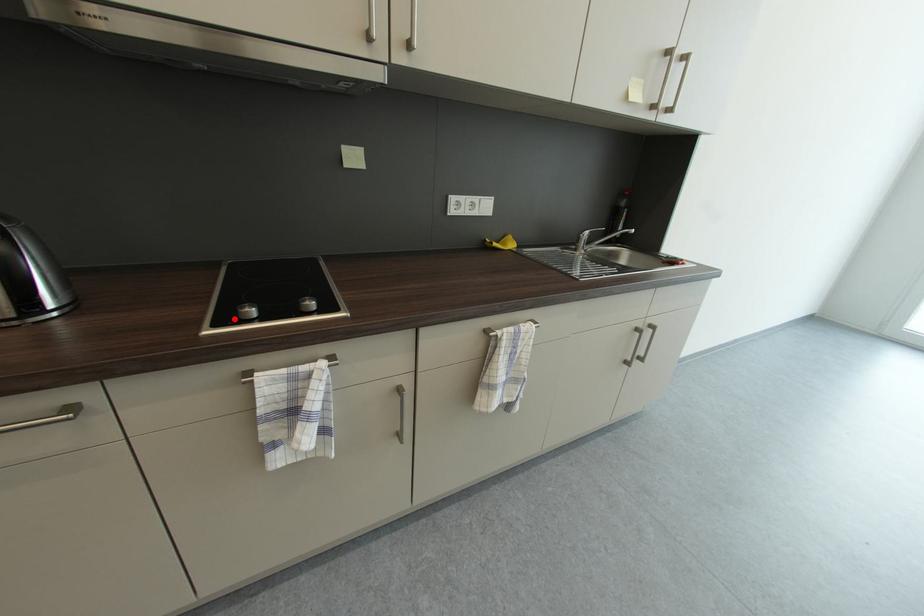
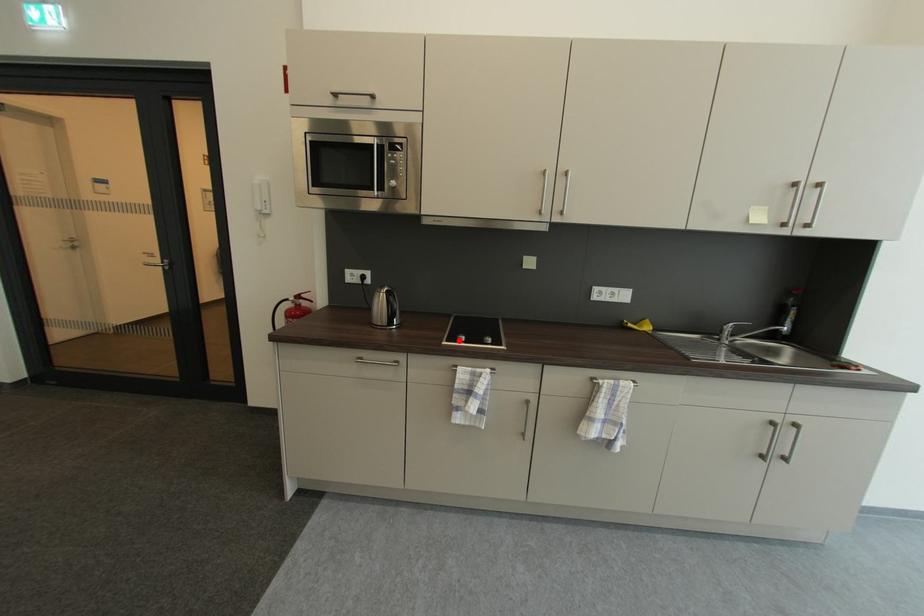
I am providing you with two images of the same scene from different viewpoints. A red point is marked on the first image and another point is marked on the second image. Do the highlighted points in image1 and image2 indicate the same real-world spot?

Yes